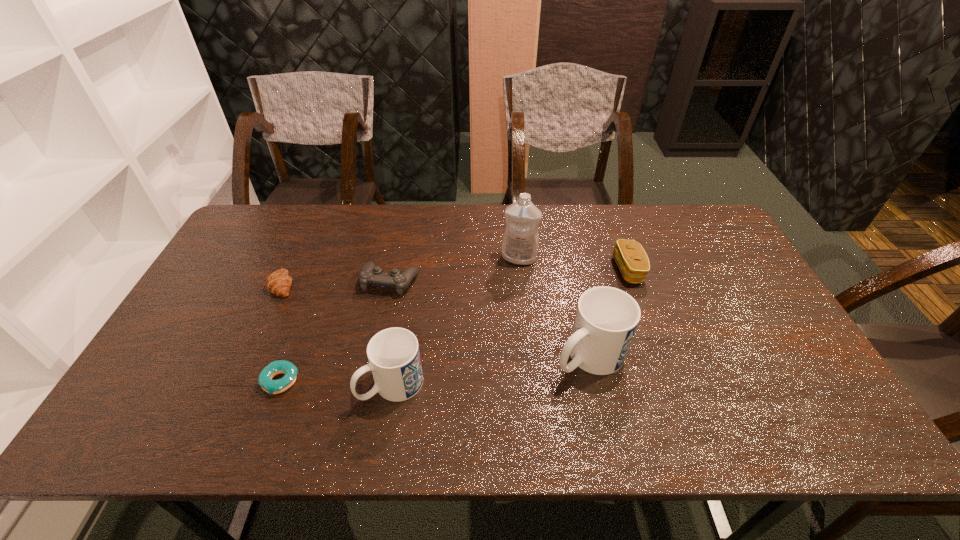
Given the evenly spaced mugs in the image, where should an extra mug be added on the right to preserve the spacing? Please point to a vacant space. Please provide its 2D coordinates. Your answer should be formatted as a tuple, i.e. [(x, y)], where the tuple contains the x and y coordinates of a point satisfying the conditions above.

[(765, 330)]